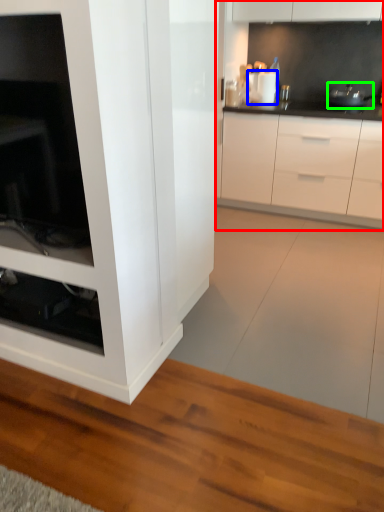
Question: Which is farther away from cabinetry (highlighted by a red box)? appliance (highlighted by a blue box) or appliance (highlighted by a green box)?

Choices:
 (A) appliance
 (B) appliance

Answer: (A)